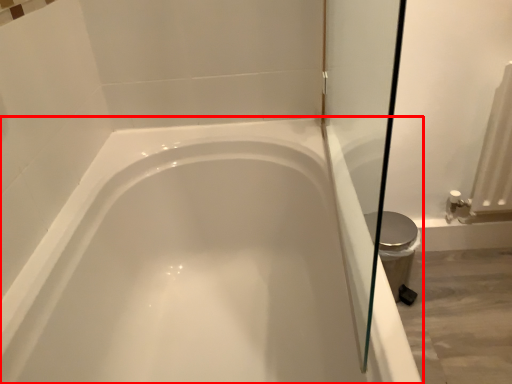
Question: From the image's perspective, where is bathtub (annotated by the red box) located relative to bidet?

Choices:
 (A) below
 (B) above

Answer: (A)